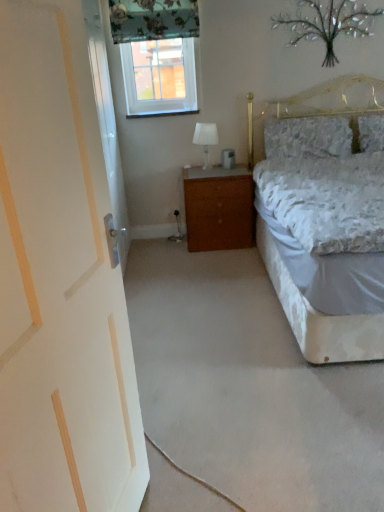
I want to click on vacant region in front of wooden nightstand at center, so (220, 258).